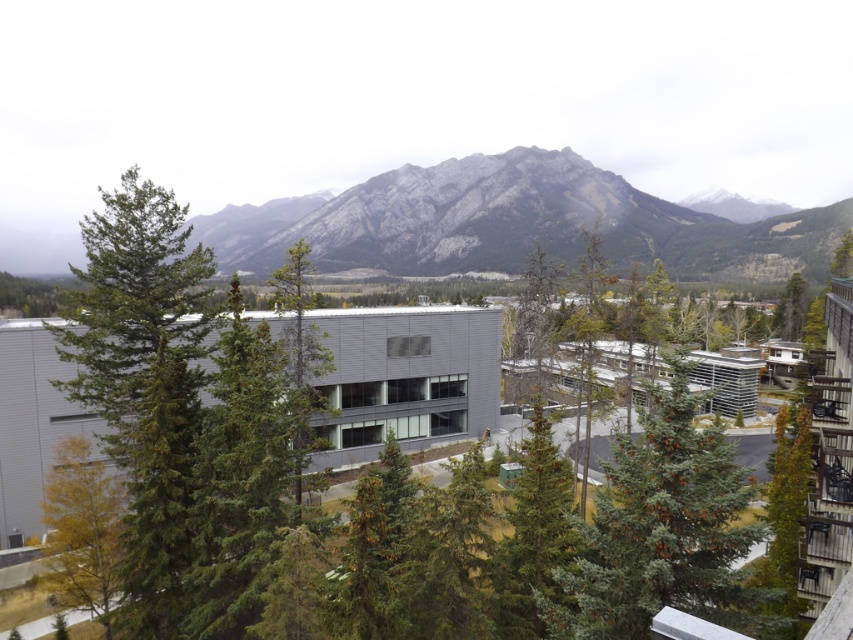
Which is below, green coniferous tree at center or yellow-green foliage at lower left?

yellow-green foliage at lower left is below.

Can you confirm if green coniferous tree at center is positioned below yellow-green foliage at lower left?

No, green coniferous tree at center is not below yellow-green foliage at lower left.

The image size is (853, 640). I want to click on green coniferous tree at center, so click(x=664, y=529).

Does point (688, 509) lie in front of point (303, 324)?

That is True.

Looking at this image, is green coniferous tree at center in front of green matte tree at center?

Yes, it is in front of green matte tree at center.

Between point (688, 364) and point (306, 328), which one is positioned behind?

The point (306, 328) is behind.

You are a GUI agent. You are given a task and a screenshot of the screen. Output one action in this format:
    pyautogui.click(x=<x>, y=<y>)
    Task: Click on the green coniferous tree at center
    This screenshot has height=640, width=853.
    Given the screenshot: What is the action you would take?
    pyautogui.click(x=664, y=529)

Between point (306, 276) and point (795, 332), which one is positioned behind?

The point (795, 332) is behind.

Does green matte tree at center appear on the left side of green matte tree at upper right?

Indeed, green matte tree at center is positioned on the left side of green matte tree at upper right.

Is point (274, 278) positioned in front of point (791, 333)?

That is True.

Find the location of a particular element. This screenshot has width=853, height=640. green matte tree at center is located at coordinates tap(299, 320).